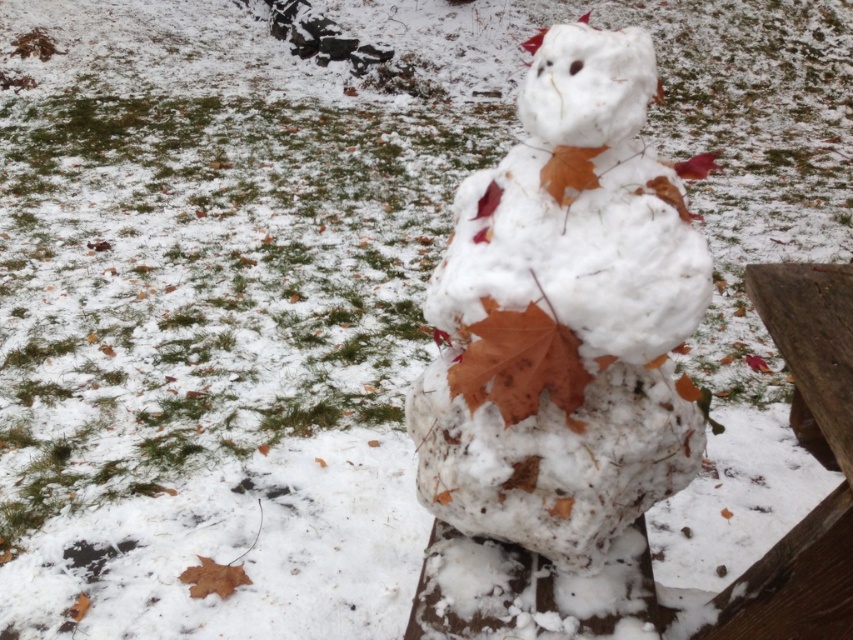
You are a child who wants to place the brown matte leaf at center on top of the wooden bench at center. Is the leaf able to be placed there without falling off?

The wooden bench at center is much taller than brown matte leaf at center, so the leaf will not be able to stay on top of the wooden bench at center because it is shorter and might not have enough surface area to balance.

You are standing at the point marked by the coordinate point at (566, 316). Looking around, you see a white fluffy snowman at center. What is the first object you would encounter if you walk directly forward from your current position?

The first object you would encounter is the white fluffy snowman at center because the point marks its location, so walking forward from there would lead directly to it.